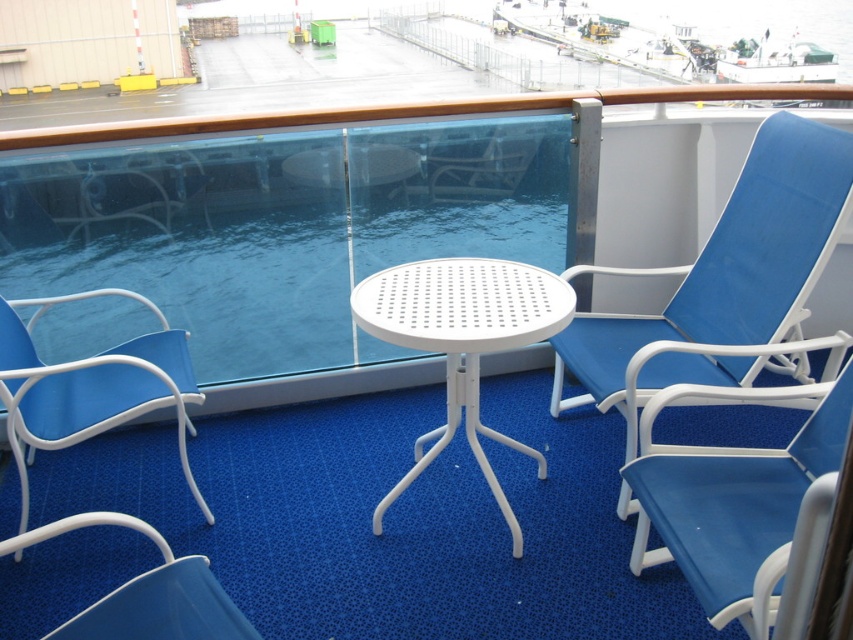
Question: Is white plastic table at center smaller than matte white beach chair at lower left?

Choices:
 (A) no
 (B) yes

Answer: (A)

Question: From the image, what is the correct spatial relationship of blue fabric beach chair at right in relation to blue fabric beach chair at lower right?

Choices:
 (A) right
 (B) left

Answer: (A)

Question: Based on their relative distances, which object is farther from the blue fabric beach chair at lower right?

Choices:
 (A) matte white beach chair at lower left
 (B) blue fabric beach chair at right

Answer: (A)

Question: Which point is closer to the camera taking this photo?

Choices:
 (A) (830, 136)
 (B) (817, 436)
 (C) (547, 269)
 (D) (165, 348)

Answer: (B)

Question: Among these objects, which one is nearest to the camera?

Choices:
 (A) matte white beach chair at lower left
 (B) white plastic table at center
 (C) blue fabric beach chair at right

Answer: (B)

Question: Does matte white beach chair at lower left have a greater width compared to matte blue beach chair at lower left?

Choices:
 (A) no
 (B) yes

Answer: (B)